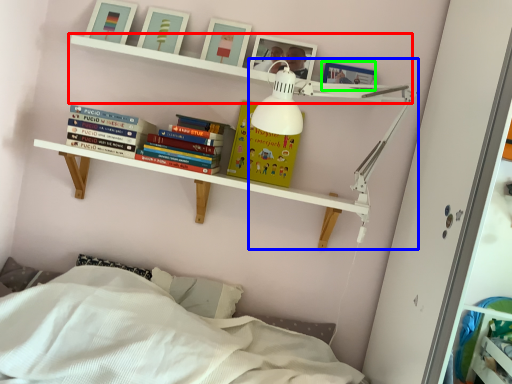
Question: Estimate the real-world distances between objects in this image. Which object is farther from shelf (highlighted by a red box), lamp (highlighted by a blue box) or picture frame (highlighted by a green box)?

Choices:
 (A) lamp
 (B) picture frame

Answer: (B)